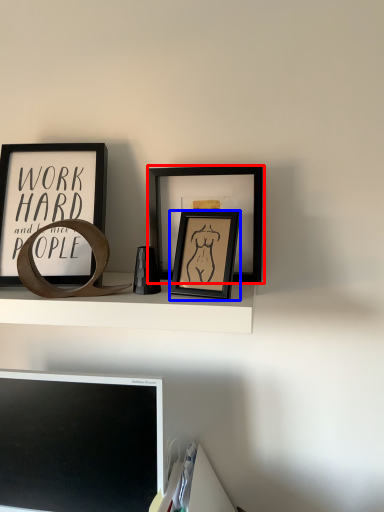
Question: Among these objects, which one is nearest to the camera, picture frame (highlighted by a red box) or picture frame (highlighted by a blue box)?

Choices:
 (A) picture frame
 (B) picture frame

Answer: (B)